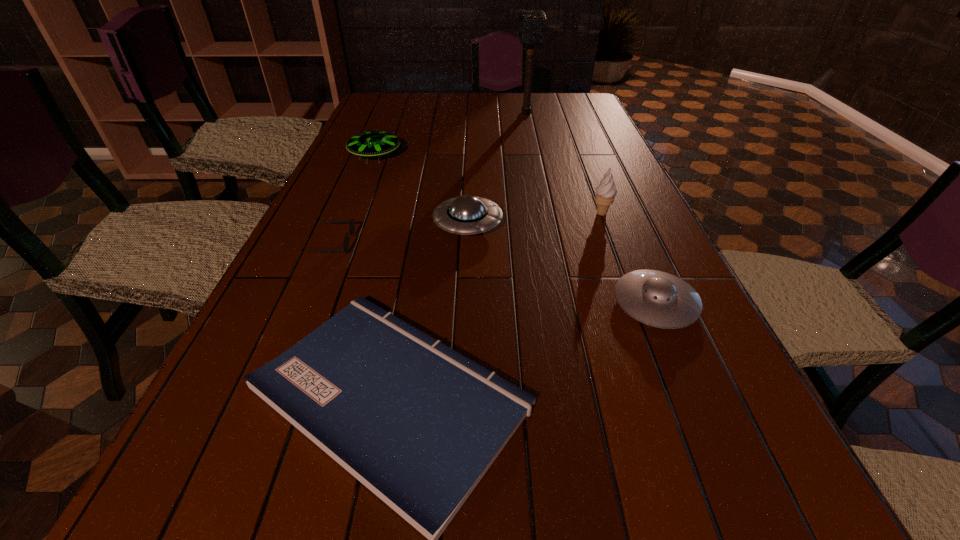
You are a GUI agent. You are given a task and a screenshot of the screen. Output one action in this format:
    pyautogui.click(x=<x>, y=<y>)
    Task: Click on the farthest object
    The height and width of the screenshot is (540, 960).
    Given the screenshot: What is the action you would take?
    pyautogui.click(x=532, y=23)

Identify the location of mallet. This screenshot has height=540, width=960. (532, 23).

At what (x,y) coordinates should I click in order to perform the action: click on icecream. Please return your answer as a coordinate pair (x, y). This screenshot has width=960, height=540. Looking at the image, I should click on (605, 193).

You are a GUI agent. You are given a task and a screenshot of the screen. Output one action in this format:
    pyautogui.click(x=<x>, y=<y>)
    Task: Click on the farthest saucer
    
    Given the screenshot: What is the action you would take?
    pyautogui.click(x=371, y=143)

Find the location of `the leftmost saucer`. the leftmost saucer is located at coordinates (371, 143).

Find the location of a particular element. the second nearest saucer is located at coordinates (466, 215).

Where is `the nearest saucer`? This screenshot has width=960, height=540. the nearest saucer is located at coordinates (658, 299).

The height and width of the screenshot is (540, 960). In order to click on the rightmost saucer in this screenshot , I will do `click(658, 299)`.

In order to click on the second shortest object in this screenshot , I will do `click(352, 223)`.

In order to click on vacant space located on the back of the farthest object in this screenshot , I will do `click(523, 99)`.